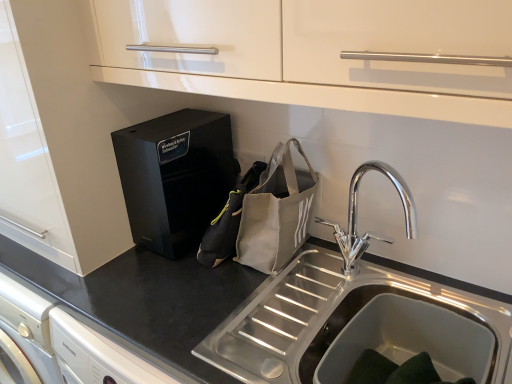
Question: Does gray fabric pouch at center, placed as the 1th pouch when sorted from left to right, appear on the left side of black glossy speaker at center?

Choices:
 (A) yes
 (B) no

Answer: (B)

Question: Does gray fabric pouch at center, the second pouch viewed from the right, have a larger size compared to black glossy speaker at center?

Choices:
 (A) no
 (B) yes

Answer: (A)

Question: Is gray fabric pouch at center, the second pouch viewed from the right, smaller than black glossy speaker at center?

Choices:
 (A) no
 (B) yes

Answer: (B)

Question: Does gray fabric pouch at center, placed as the 1th pouch when sorted from left to right, lie in front of black glossy speaker at center?

Choices:
 (A) no
 (B) yes

Answer: (B)

Question: Could you tell me if gray fabric pouch at center, the second pouch viewed from the right, is facing black glossy speaker at center?

Choices:
 (A) yes
 (B) no

Answer: (A)

Question: From the image's perspective, is gray fabric pouch at center, placed as the 1th pouch when sorted from left to right, on top of black glossy speaker at center?

Choices:
 (A) yes
 (B) no

Answer: (B)

Question: From the image's perspective, is black matte countertop at center located beneath gray fabric pouch at center, the second pouch viewed from the right?

Choices:
 (A) no
 (B) yes

Answer: (B)

Question: Is black matte countertop at center oriented towards gray fabric pouch at center, the second pouch viewed from the right?

Choices:
 (A) no
 (B) yes

Answer: (A)

Question: Would you say black matte countertop at center is a long distance from gray fabric pouch at center, placed as the 1th pouch when sorted from left to right?

Choices:
 (A) yes
 (B) no

Answer: (B)

Question: Is black matte countertop at center shorter than gray fabric pouch at center, the second pouch viewed from the right?

Choices:
 (A) no
 (B) yes

Answer: (A)

Question: Is black matte countertop at center located outside gray fabric pouch at center, the second pouch viewed from the right?

Choices:
 (A) yes
 (B) no

Answer: (A)

Question: Is black matte countertop at center bigger than gray fabric pouch at center, placed as the 1th pouch when sorted from left to right?

Choices:
 (A) yes
 (B) no

Answer: (A)

Question: Considering the relative sizes of gray fabric pouch at center, the second pouch viewed from the right, and canvas tote bag at sink, positioned as the 1th pouch in right-to-left order, in the image provided, is gray fabric pouch at center, the second pouch viewed from the right, wider than canvas tote bag at sink, positioned as the 1th pouch in right-to-left order,?

Choices:
 (A) no
 (B) yes

Answer: (A)